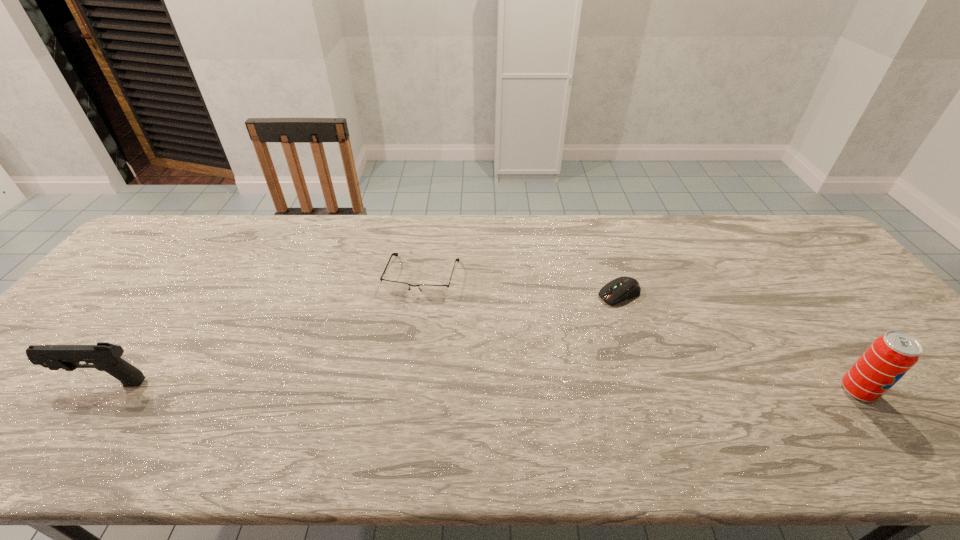
I want to click on pistol, so click(104, 356).

This screenshot has height=540, width=960. In order to click on the second tallest object in this screenshot , I will do `click(104, 356)`.

Image resolution: width=960 pixels, height=540 pixels. In order to click on the tallest object in this screenshot , I will do `click(890, 356)`.

This screenshot has height=540, width=960. In order to click on the rightmost object in this screenshot , I will do `click(890, 356)`.

I want to click on the second object from right to left, so click(622, 288).

The width and height of the screenshot is (960, 540). I want to click on the second object from left to right, so coord(435,291).

Image resolution: width=960 pixels, height=540 pixels. Find the location of `free space located 0.220m on the back of the tallest object`. free space located 0.220m on the back of the tallest object is located at coordinates click(798, 309).

Image resolution: width=960 pixels, height=540 pixels. I want to click on vacant space located 0.110m on the button of the computer equipment, so click(571, 315).

The image size is (960, 540). I want to click on vacant space located on the button of the computer equipment, so click(x=486, y=357).

At what (x,y) coordinates should I click in order to perform the action: click on free location located on the button of the computer equipment. Please return your answer as a coordinate pair (x, y). Looking at the image, I should click on (583, 309).